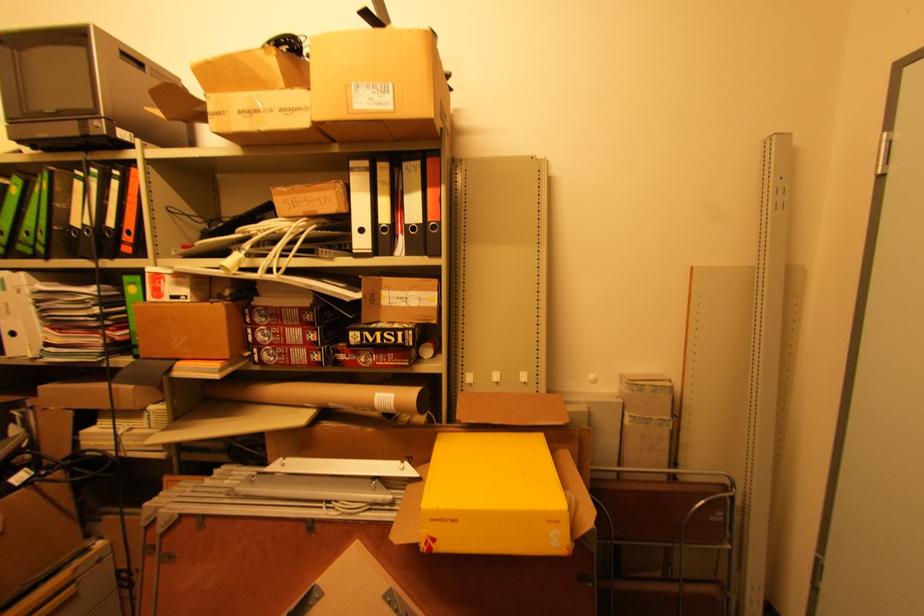
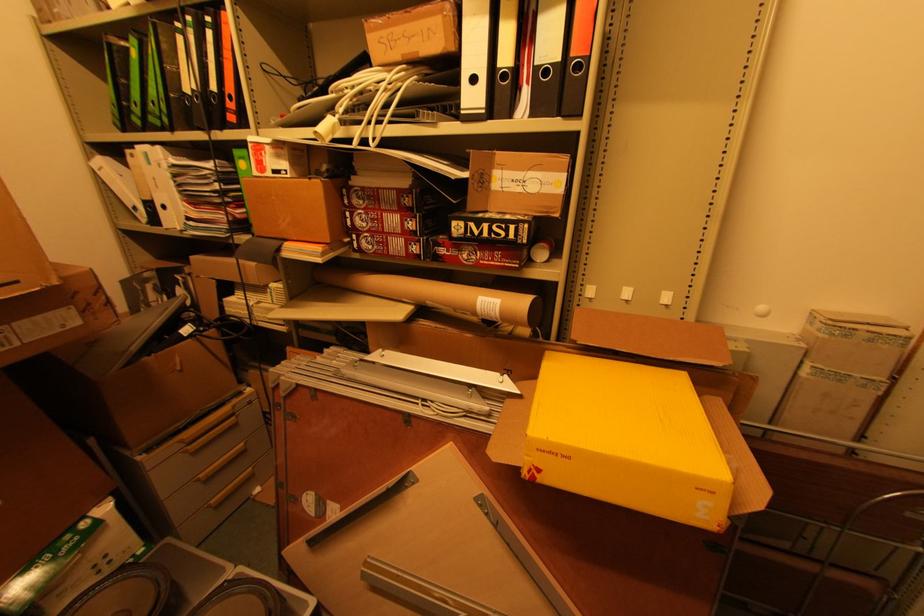
Based on the continuous images, in which direction is the camera rotating?

The camera rotated toward left-down.